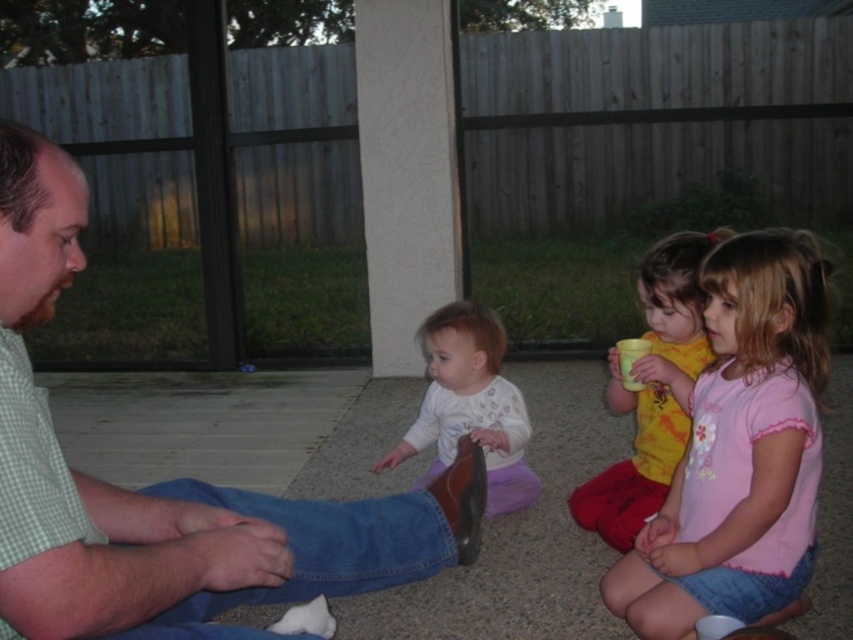
Question: Which of these objects is positioned closest to the pink cotton shirt at right?

Choices:
 (A) white soft shirt at center
 (B) matte yellow cup at center right

Answer: (B)

Question: Does pink cotton shirt at right appear on the left side of matte yellow cup at center right?

Choices:
 (A) no
 (B) yes

Answer: (A)

Question: Is green checkered shirt at left bigger than matte yellow cup at center right?

Choices:
 (A) no
 (B) yes

Answer: (B)

Question: In this image, where is green checkered shirt at left located relative to matte yellow cup at center right?

Choices:
 (A) above
 (B) below

Answer: (B)

Question: Which of the following is the farthest from the observer?

Choices:
 (A) matte yellow cup at center right
 (B) white soft shirt at center
 (C) pink cotton shirt at right
 (D) green checkered shirt at left

Answer: (B)

Question: Which point is closer to the camera?

Choices:
 (A) green checkered shirt at left
 (B) matte yellow cup at center right

Answer: (A)